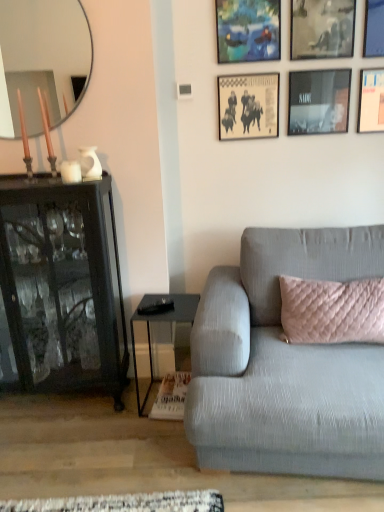
At what (x,y) coordinates should I click in order to perform the action: click on free spot in front of black glass cabinet at left. Please return your answer as a coordinate pair (x, y). Looking at the image, I should click on (54, 455).